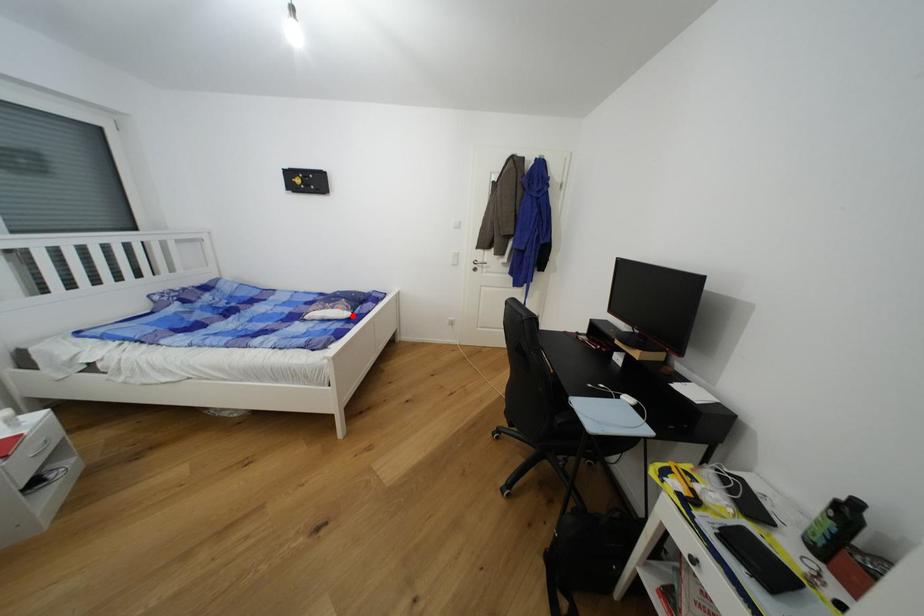
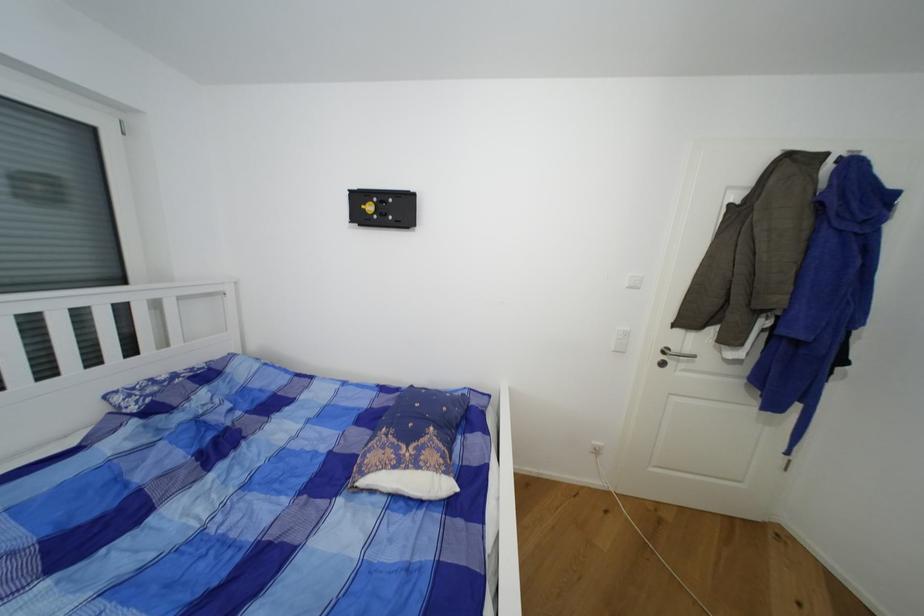
The point at the highlighted location is marked in the first image. Where is the corresponding point in the second image?

(454, 488)